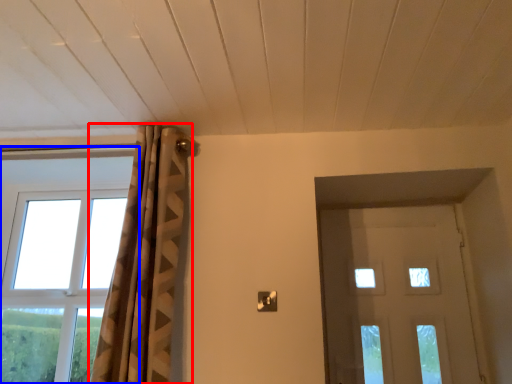
Question: Which object appears closest to the camera in this image, curtain (highlighted by a red box) or window (highlighted by a blue box)?

Choices:
 (A) curtain
 (B) window

Answer: (A)